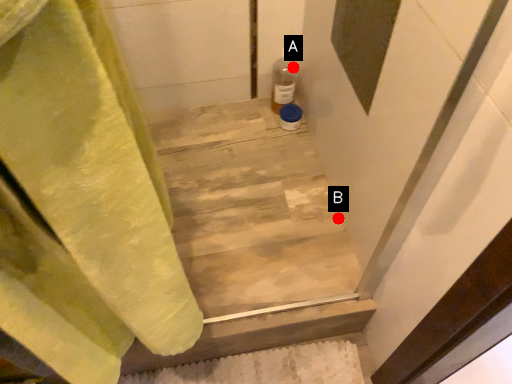
Question: Two points are circled on the image, labeled by A and B beside each circle. Which point appears farthest from the camera in this image?

Choices:
 (A) A is further
 (B) B is further

Answer: (A)